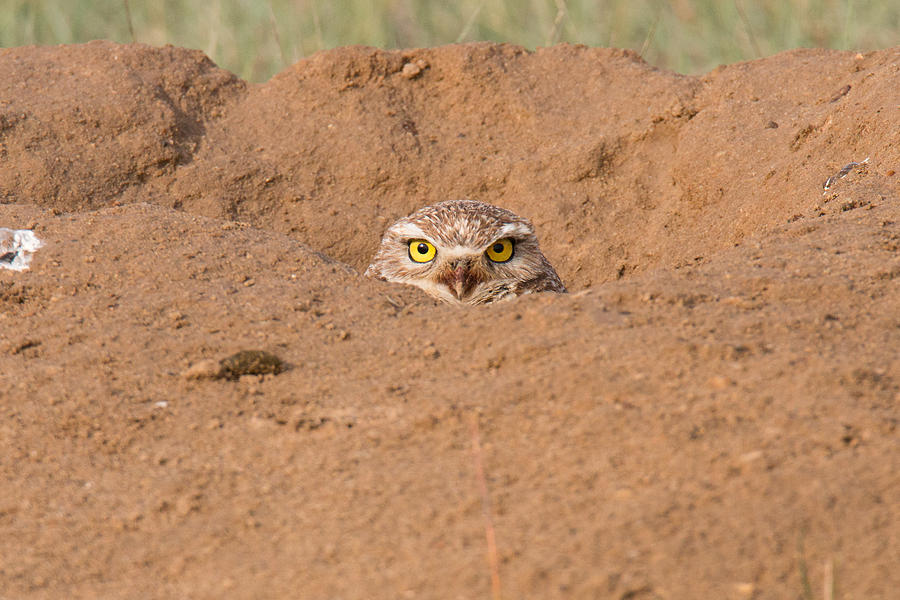
Find the location of a particular element. white fur is located at coordinates (x=483, y=243).